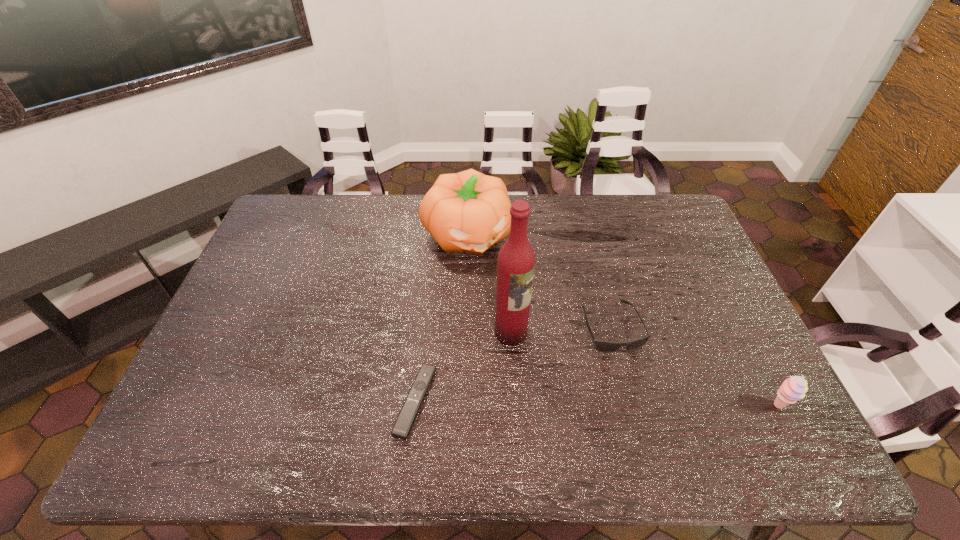
At what (x,y) coordinates should I click in order to perform the action: click on free area in between the pumpkin and the shortest object. Please return your answer as a coordinate pair (x, y). This screenshot has width=960, height=540. Looking at the image, I should click on (442, 317).

Image resolution: width=960 pixels, height=540 pixels. Identify the location of free spot between the third shortest object and the fourth object from left to right. (695, 366).

Locate an element on the screen. vacant space that's between the remote control and the sherbert is located at coordinates (596, 403).

Where is `unoccupied position between the shortest object and the fourth object from left to right`? This screenshot has width=960, height=540. unoccupied position between the shortest object and the fourth object from left to right is located at coordinates (514, 364).

The height and width of the screenshot is (540, 960). I want to click on free space between the pumpkin and the rightmost object, so click(622, 320).

You are a GUI agent. You are given a task and a screenshot of the screen. Output one action in this format:
    pyautogui.click(x=<x>, y=<y>)
    Task: Click on the free space between the sherbert and the shortest object
    Image resolution: width=960 pixels, height=540 pixels.
    Given the screenshot: What is the action you would take?
    pyautogui.click(x=596, y=403)

Locate an element on the screen. This screenshot has width=960, height=540. free space between the tallest object and the pumpkin is located at coordinates (489, 283).

At what (x,y) coordinates should I click in order to perform the action: click on free space between the second object from right to left and the second tallest object. Please return your answer as a coordinate pair (x, y). Looking at the image, I should click on (540, 280).

The height and width of the screenshot is (540, 960). Identify the location of vacant space that's between the third shortest object and the tallest object. (644, 369).

Select which object is the second closest to the second tallest object. Please provide its 2D coordinates. Your answer should be formatted as a tuple, i.e. [(x, y)], where the tuple contains the x and y coordinates of a point satisfying the conditions above.

[(604, 346)]